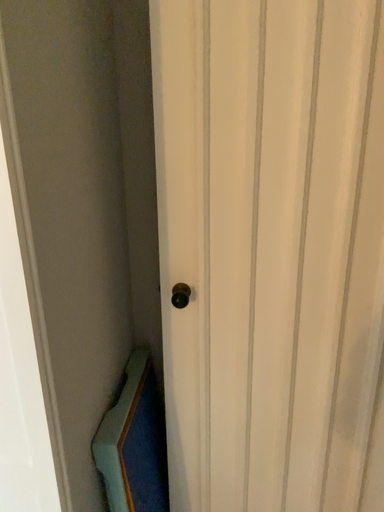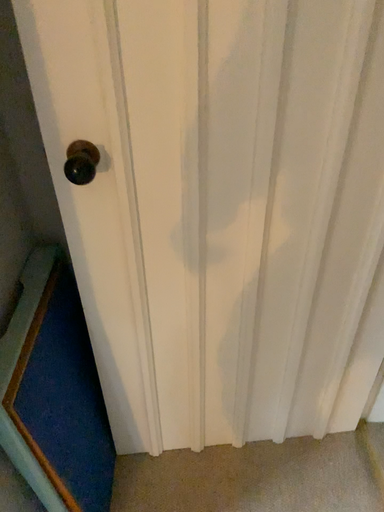
Question: How did the camera likely rotate when shooting the video?

Choices:
 (A) rotated right
 (B) rotated left

Answer: (A)